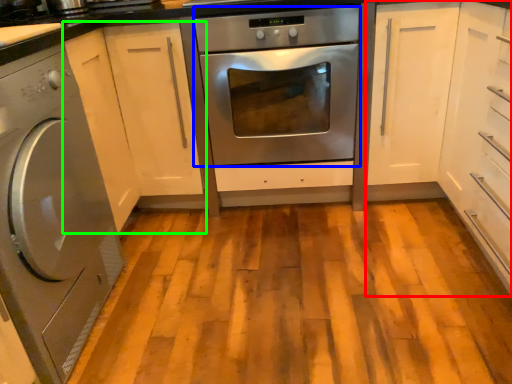
Question: Estimate the real-world distances between objects in this image. Which object is farther from cabinetry (highlighted by a red box), oven (highlighted by a blue box) or cabinetry (highlighted by a green box)?

Choices:
 (A) oven
 (B) cabinetry

Answer: (B)